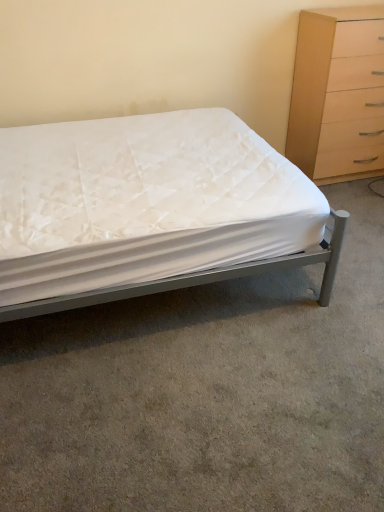
Image resolution: width=384 pixels, height=512 pixels. Describe the element at coordinates (338, 94) in the screenshot. I see `light wood/texture chest of drawers at upper right` at that location.

This screenshot has width=384, height=512. Identify the location of light wood/texture chest of drawers at upper right. (338, 94).

In order to face light wood/texture chest of drawers at upper right, should I rotate leftwards or rightwards?

Turn right approximately 21.260 degrees to face it.

Image resolution: width=384 pixels, height=512 pixels. Describe the element at coordinates (150, 210) in the screenshot. I see `metallic gray bed at center` at that location.

At what (x,y) coordinates should I click in order to perform the action: click on metallic gray bed at center. Please return your answer as a coordinate pair (x, y). The height and width of the screenshot is (512, 384). Looking at the image, I should click on (150, 210).

Locate an element on the screen. This screenshot has height=512, width=384. light wood/texture chest of drawers at upper right is located at coordinates (338, 94).

Which object is positioned more to the right, light wood/texture chest of drawers at upper right or metallic gray bed at center?

Positioned to the right is light wood/texture chest of drawers at upper right.

Is light wood/texture chest of drawers at upper right positioned behind metallic gray bed at center?

That is True.

Considering the positions of point (314, 34) and point (136, 214), is point (314, 34) closer or farther from the camera than point (136, 214)?

Point (314, 34) is farther from the camera than point (136, 214).

From the image's perspective, which is below, light wood/texture chest of drawers at upper right or metallic gray bed at center?

metallic gray bed at center appears lower in the image.

Consider the image. From a real-world perspective, who is located lower, light wood/texture chest of drawers at upper right or metallic gray bed at center?

In real-world perspective, metallic gray bed at center is lower.

Can you confirm if light wood/texture chest of drawers at upper right is thinner than metallic gray bed at center?

Indeed, light wood/texture chest of drawers at upper right has a lesser width compared to metallic gray bed at center.

Between light wood/texture chest of drawers at upper right and metallic gray bed at center, which one has less height?

With less height is metallic gray bed at center.

In the scene shown: Is light wood/texture chest of drawers at upper right bigger than metallic gray bed at center?

No, light wood/texture chest of drawers at upper right is not bigger than metallic gray bed at center.

Is light wood/texture chest of drawers at upper right completely or partially outside of metallic gray bed at center?

Indeed, light wood/texture chest of drawers at upper right is completely outside metallic gray bed at center.

Is light wood/texture chest of drawers at upper right far away from metallic gray bed at center?

Result: Yes.

Is light wood/texture chest of drawers at upper right looking in the opposite direction of metallic gray bed at center?

No, light wood/texture chest of drawers at upper right is not facing away from metallic gray bed at center.

The image size is (384, 512). What are the coordinates of `bed lying below the light wood/texture chest of drawers at upper right (from the image's perspective)` in the screenshot? It's located at (150, 210).

Is metallic gray bed at center to the left of light wood/texture chest of drawers at upper right from the viewer's perspective?

Indeed, metallic gray bed at center is positioned on the left side of light wood/texture chest of drawers at upper right.

Is the depth of metallic gray bed at center greater than that of light wood/texture chest of drawers at upper right?

No, metallic gray bed at center is closer to the viewer.

Which is in front, point (49, 278) or point (380, 142)?

The point (49, 278) is more forward.

From the image's perspective, which object appears higher, metallic gray bed at center or light wood/texture chest of drawers at upper right?

light wood/texture chest of drawers at upper right.

From a real-world perspective, who is located lower, metallic gray bed at center or light wood/texture chest of drawers at upper right?

metallic gray bed at center is physically lower.

Considering the sizes of objects metallic gray bed at center and light wood/texture chest of drawers at upper right in the image provided, who is thinner, metallic gray bed at center or light wood/texture chest of drawers at upper right?

Thinner between the two is light wood/texture chest of drawers at upper right.

Between metallic gray bed at center and light wood/texture chest of drawers at upper right, which one has more height?

Result: Standing taller between the two is light wood/texture chest of drawers at upper right.

Can you confirm if metallic gray bed at center is bigger than light wood/texture chest of drawers at upper right?

Yes.

Can we say metallic gray bed at center lies outside light wood/texture chest of drawers at upper right?

Indeed, metallic gray bed at center is completely outside light wood/texture chest of drawers at upper right.

Is metallic gray bed at center next to light wood/texture chest of drawers at upper right and touching it?

metallic gray bed at center is not next to light wood/texture chest of drawers at upper right, and they're not touching.

Is light wood/texture chest of drawers at upper right at the back of metallic gray bed at center?

No, metallic gray bed at center's orientation is not away from light wood/texture chest of drawers at upper right.

How many degrees apart are the facing directions of metallic gray bed at center and light wood/texture chest of drawers at upper right?

90.5 degrees separate the facing orientations of metallic gray bed at center and light wood/texture chest of drawers at upper right.

Measure the distance between metallic gray bed at center and light wood/texture chest of drawers at upper right.

3.67 feet.

The height and width of the screenshot is (512, 384). In order to click on chest of drawers on the right of metallic gray bed at center in this screenshot , I will do `click(338, 94)`.

Identify the location of chest of drawers lying on the right of metallic gray bed at center. (338, 94).

Find the location of `bed in front of the light wood/texture chest of drawers at upper right`. bed in front of the light wood/texture chest of drawers at upper right is located at coordinates (150, 210).